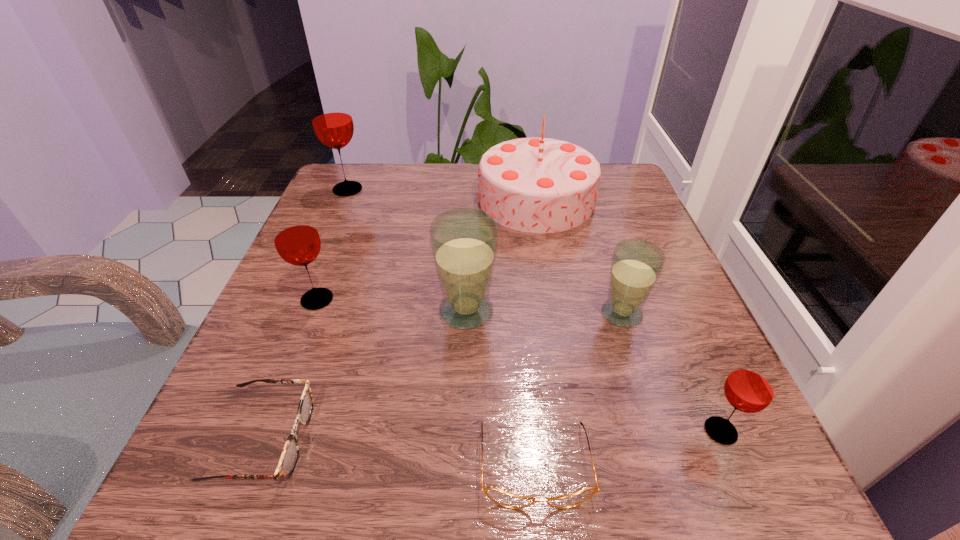
You are a GUI agent. You are given a task and a screenshot of the screen. Output one action in this format:
    pyautogui.click(x=<x>, y=<y>)
    Task: Click on the left spectacles
    The width and height of the screenshot is (960, 540).
    Given the screenshot: What is the action you would take?
    point(290,453)

You are a GUI agent. You are given a task and a screenshot of the screen. Output one action in this format:
    pyautogui.click(x=<x>, y=<y>)
    Task: Click on the gold spectacles
    The height and width of the screenshot is (540, 960).
    Given the screenshot: What is the action you would take?
    pyautogui.click(x=505, y=499)

Find the location of `blank space located 0.120m on the front of the farthest red glass`. blank space located 0.120m on the front of the farthest red glass is located at coordinates pyautogui.click(x=331, y=230).

Where is `vacant position located 0.340m on the front of the birthday cake`? Image resolution: width=960 pixels, height=540 pixels. vacant position located 0.340m on the front of the birthday cake is located at coordinates (565, 366).

Where is `free space located 0.050m on the back of the second farthest red glass`? The height and width of the screenshot is (540, 960). free space located 0.050m on the back of the second farthest red glass is located at coordinates (329, 269).

What are the coordinates of `blank space located on the back of the bigger blue glass` in the screenshot? It's located at (468, 266).

What are the coordinates of `vacant space located 0.060m on the back of the smaller blue glass` in the screenshot? It's located at (610, 275).

This screenshot has height=540, width=960. Find the location of `free space located on the left of the nearest red glass`. free space located on the left of the nearest red glass is located at coordinates (628, 431).

Locate an element on the screen. free location located 0.140m on the frame of the left spectacles is located at coordinates (410, 439).

You are a GUI agent. You are given a task and a screenshot of the screen. Output one action in this format:
    pyautogui.click(x=<x>, y=<y>)
    Task: Click on the glass that is at the far edge
    
    Given the screenshot: What is the action you would take?
    pyautogui.click(x=331, y=117)